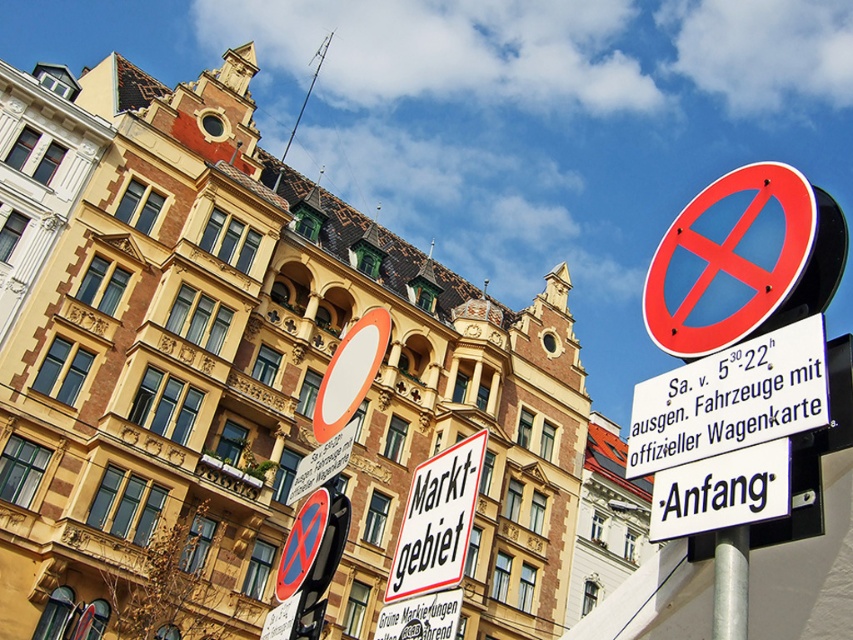
Does white paper sign at center appear over silver metallic pole at lower right?

Actually, white paper sign at center is below silver metallic pole at lower right.

Is white paper sign at center thinner than silver metallic pole at lower right?

No.

Between point (457, 563) and point (740, 556), which one is positioned behind?

The point (457, 563) is behind.

At what (x,y) coordinates should I click in order to perform the action: click on white paper sign at center. Please return your answer as a coordinate pair (x, y). Image resolution: width=853 pixels, height=640 pixels. Looking at the image, I should click on (437, 520).